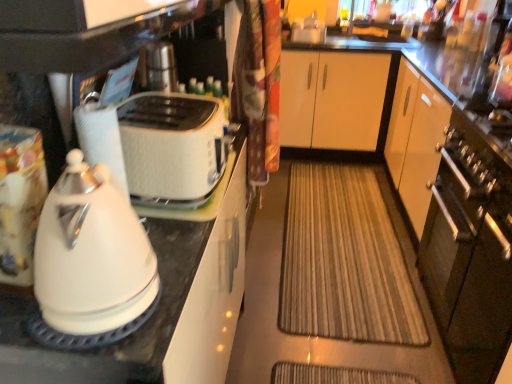
Question: Is satin silver oven at right at the left side of white glossy paper towel at left?

Choices:
 (A) yes
 (B) no

Answer: (B)

Question: From the image's perspective, does satin silver oven at right appear lower than white glossy paper towel at left?

Choices:
 (A) no
 (B) yes

Answer: (B)

Question: Can you confirm if satin silver oven at right is smaller than white glossy paper towel at left?

Choices:
 (A) yes
 (B) no

Answer: (B)

Question: Would you say satin silver oven at right is a long distance from white glossy paper towel at left?

Choices:
 (A) yes
 (B) no

Answer: (A)

Question: Is satin silver oven at right wider than white glossy paper towel at left?

Choices:
 (A) yes
 (B) no

Answer: (A)

Question: Looking at the image, does brown textured mat at center seem bigger or smaller compared to white glossy paper towel at left?

Choices:
 (A) big
 (B) small

Answer: (A)

Question: From the image's perspective, relative to white glossy paper towel at left, is brown textured mat at center above or below?

Choices:
 (A) above
 (B) below

Answer: (B)

Question: Considering the positions of point (367, 297) and point (109, 148), is point (367, 297) closer or farther from the camera than point (109, 148)?

Choices:
 (A) farther
 (B) closer

Answer: (A)

Question: Which is correct: brown textured mat at center is inside white glossy paper towel at left, or outside of it?

Choices:
 (A) inside
 (B) outside

Answer: (B)

Question: Which is correct: satin silver oven at right is inside white glossy toaster at left, or outside of it?

Choices:
 (A) inside
 (B) outside

Answer: (B)

Question: Is satin silver oven at right taller or shorter than white glossy toaster at left?

Choices:
 (A) tall
 (B) short

Answer: (B)

Question: Considering the positions of satin silver oven at right and white glossy toaster at left in the image, is satin silver oven at right wider or thinner than white glossy toaster at left?

Choices:
 (A) thin
 (B) wide

Answer: (B)

Question: In terms of size, does satin silver oven at right appear bigger or smaller than white glossy toaster at left?

Choices:
 (A) small
 (B) big

Answer: (B)

Question: Relative to white glossy paper towel at left, is white glossy kettle at left in front or behind?

Choices:
 (A) front
 (B) behind

Answer: (A)

Question: From the image's perspective, relative to white glossy paper towel at left, is white glossy kettle at left above or below?

Choices:
 (A) below
 (B) above

Answer: (A)